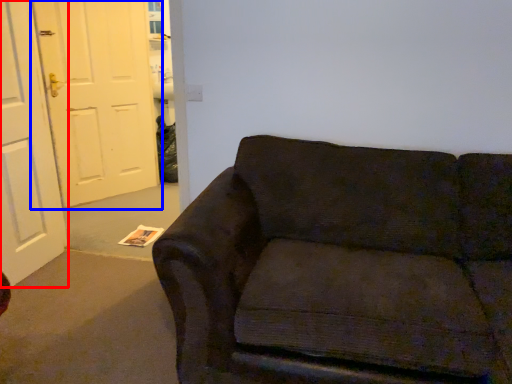
Question: Among these objects, which one is nearest to the camera, door (highlighted by a red box) or door (highlighted by a blue box)?

Choices:
 (A) door
 (B) door

Answer: (A)